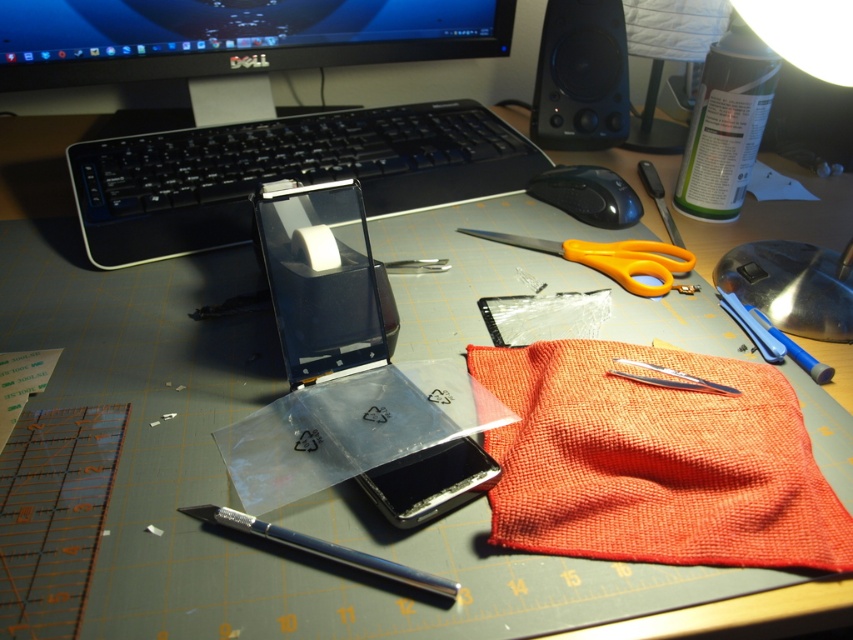
You are organizing the workspace and need to place a new item between the orange fabric at lower right and the black plastic mouse at center. Based on their positions, where should you position the new item?

The orange fabric at lower right is located below the black plastic mouse at center. To place the new item between them, position it somewhere along the vertical line between the two objects, above the orange fabric at lower right and below the black plastic mouse at center.

What object is located at the coordinate point (354, 376) on the gray cutting mat?

The transparent plastic laptop at center is located at the coordinate point (354, 376) on the gray cutting mat.